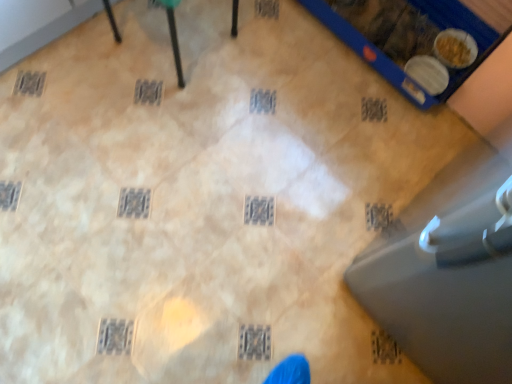
The height and width of the screenshot is (384, 512). Describe the element at coordinates (173, 36) in the screenshot. I see `matte black table at upper center` at that location.

Measure the distance between point (x=234, y=32) and camera.

Point (x=234, y=32) is 4.68 feet away from camera.

Where is `matte black table at upper center`? The height and width of the screenshot is (384, 512). matte black table at upper center is located at coordinates (173, 36).

The height and width of the screenshot is (384, 512). Identify the location of matte black table at upper center. (173, 36).